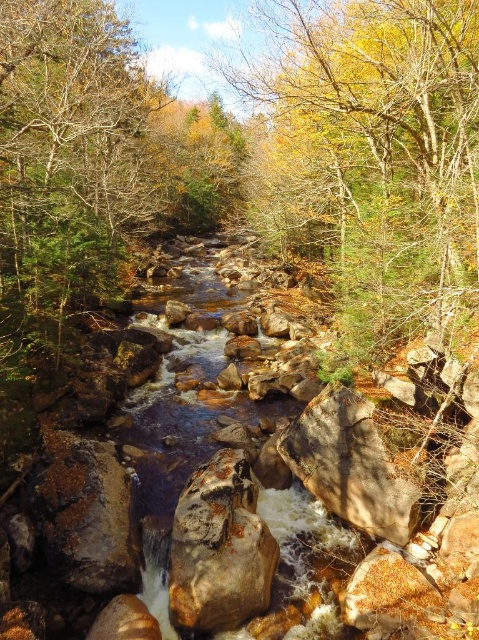
Question: Which of these objects is positioned closest to the brown wood tree at center?

Choices:
 (A) brown rough rock at center
 (B) yellow-green leaves at center

Answer: (B)

Question: Which point appears farthest from the camera in this image?

Choices:
 (A) pyautogui.click(x=101, y=236)
 (B) pyautogui.click(x=331, y=481)
 (C) pyautogui.click(x=342, y=198)

Answer: (A)

Question: Is yellow-green leaves at center above brown rough rock at center?

Choices:
 (A) yes
 (B) no

Answer: (A)

Question: Does yellow-green leaves at center have a greater width compared to brown wood tree at center?

Choices:
 (A) yes
 (B) no

Answer: (A)

Question: Which point appears farthest from the camera in this image?

Choices:
 (A) (371, 445)
 (B) (352, 136)

Answer: (B)

Question: Can you confirm if yellow-green leaves at center is positioned below brown rough rock at center?

Choices:
 (A) no
 (B) yes

Answer: (A)